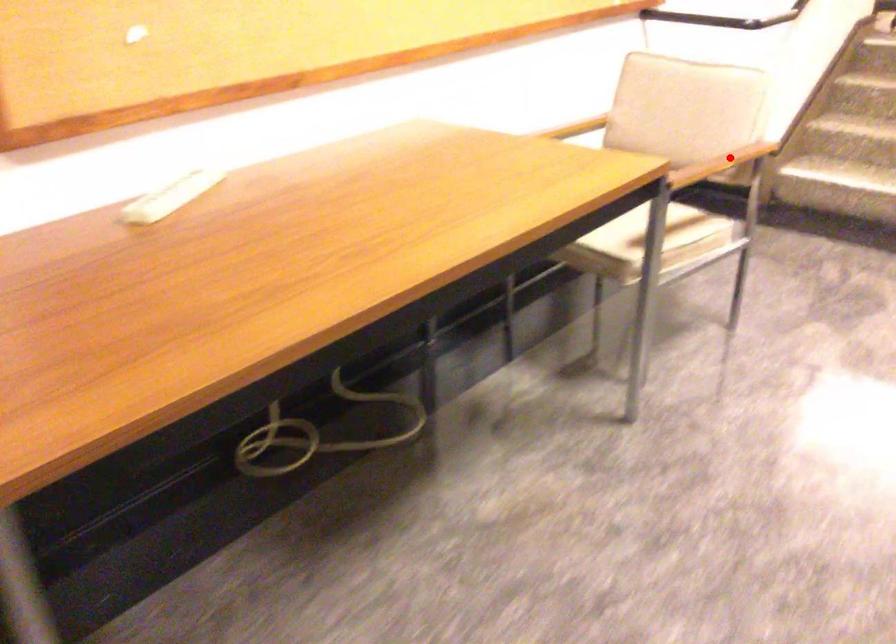
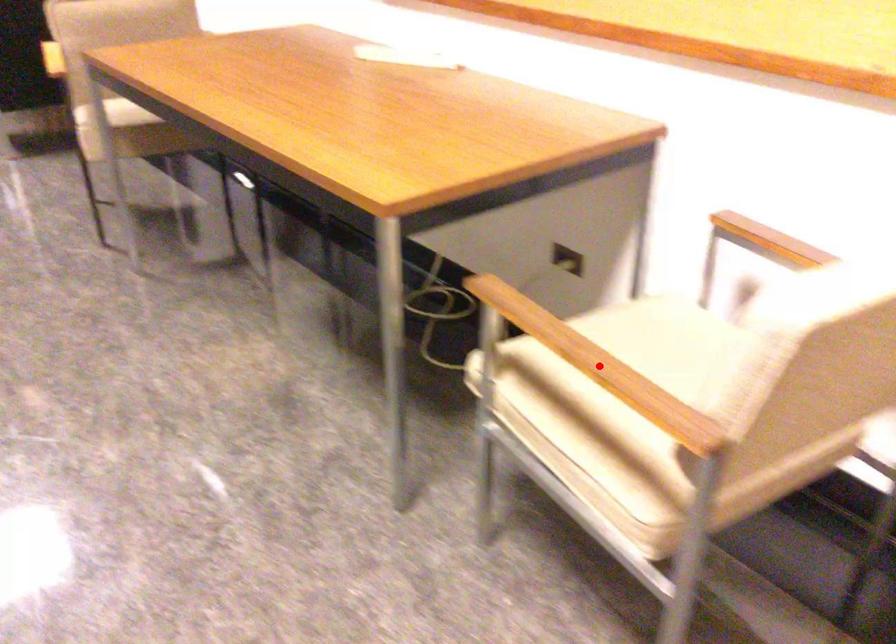
I am providing you with two images of the same scene from different viewpoints. A red point is marked on the first image and another point is marked on the second image. Do the highlighted points in image1 and image2 indicate the same real-world spot?

Yes